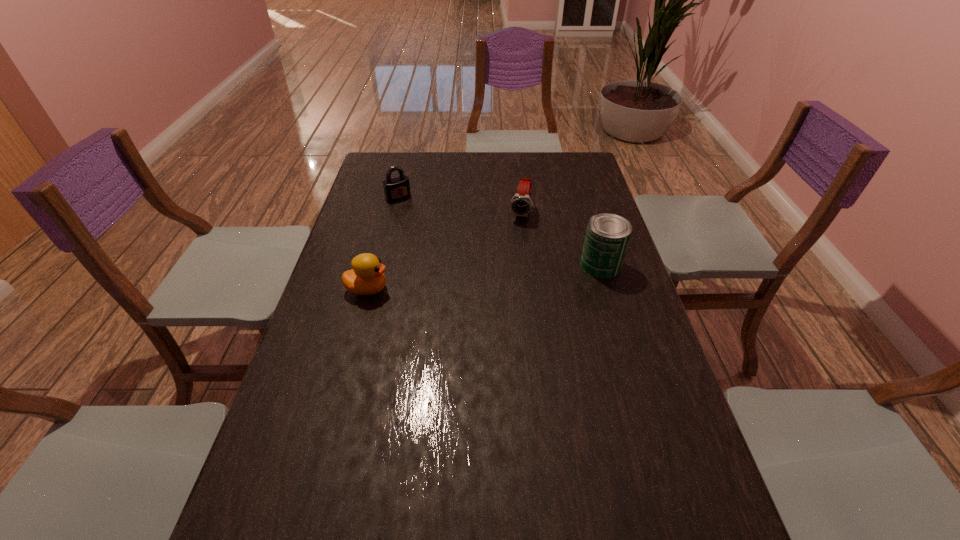
Identify the location of vacant space at the right edge. The height and width of the screenshot is (540, 960). (577, 207).

The width and height of the screenshot is (960, 540). I want to click on blank space at the near left corner of the desktop, so click(310, 506).

I want to click on free space at the near right corner, so click(679, 480).

What are the coordinates of `vacant space in between the third object from left to right and the farthest object` in the screenshot? It's located at (459, 205).

At what (x,y) coordinates should I click in order to perform the action: click on vacant space that's between the nearest object and the second nearest object. Please return your answer as a coordinate pair (x, y). The height and width of the screenshot is (540, 960). Looking at the image, I should click on (484, 277).

This screenshot has width=960, height=540. I want to click on empty space that is in between the third object from left to right and the padlock, so click(459, 205).

Find the location of a particular element. free spot between the nearest object and the third nearest object is located at coordinates (444, 251).

I want to click on vacant area that lies between the padlock and the duckling, so click(x=383, y=243).

At what (x,y) coordinates should I click in order to perform the action: click on free space that is in between the second object from right to left and the farthest object. Please return your answer as a coordinate pair (x, y). The width and height of the screenshot is (960, 540). Looking at the image, I should click on (459, 205).

Locate an element on the screen. The width and height of the screenshot is (960, 540). free spot between the second object from right to left and the nearest object is located at coordinates (444, 251).